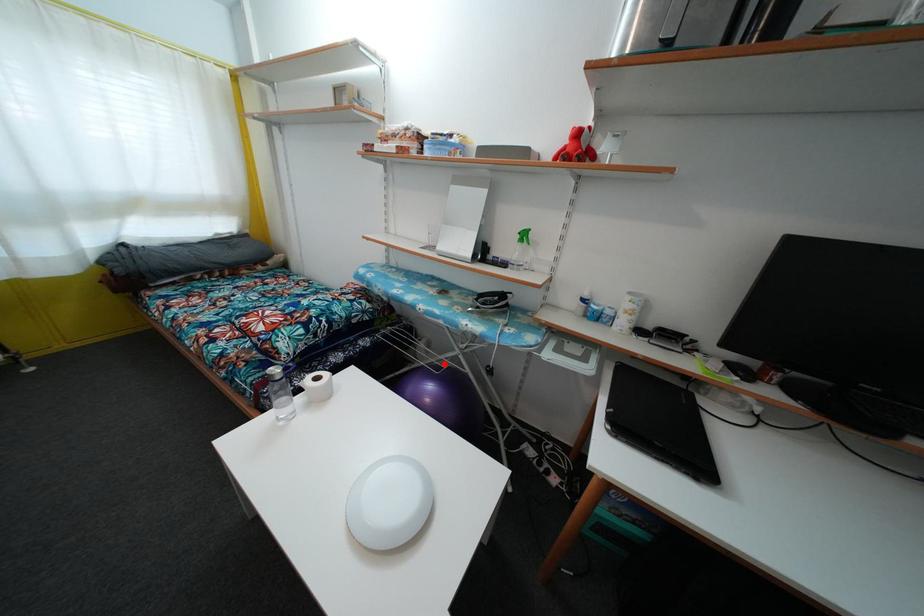
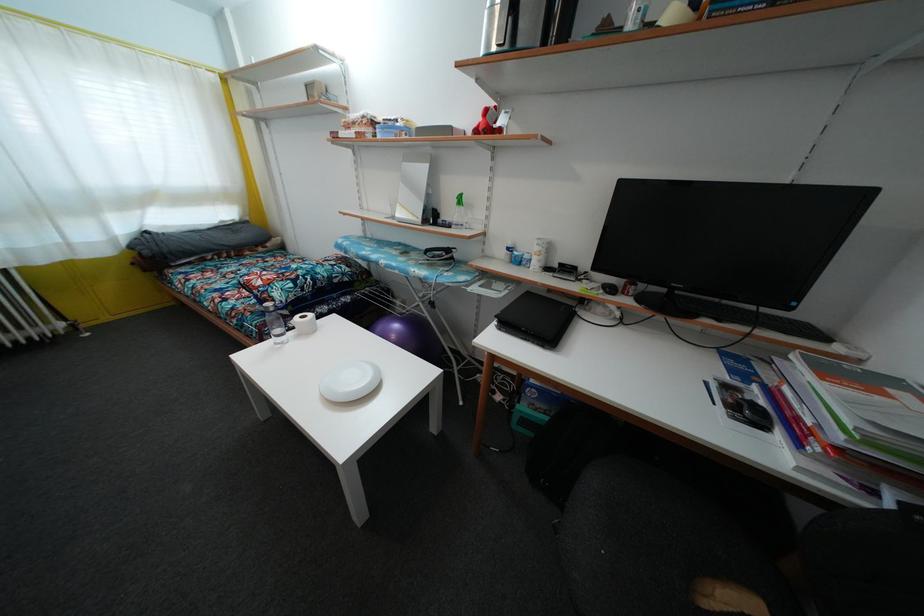
Question: A red point is marked in image1. In image2, is the corresponding 3D point closer to the camera or farther? Reply with the corresponding letter.

Choices:
 (A) The corresponding 3D point is closer.
 (B) The corresponding 3D point is farther.

Answer: (B)